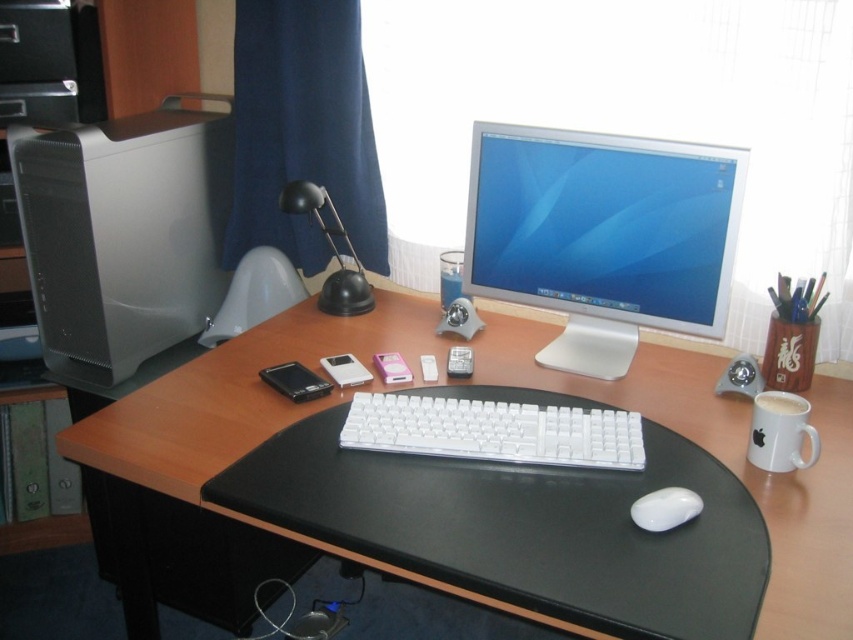
Question: Which of the following is the farthest from the observer?

Choices:
 (A) (421, 403)
 (B) (120, 330)
 (C) (285, 250)

Answer: (C)

Question: Can you confirm if satin white monitor at center is bigger than white ceramic mug at right?

Choices:
 (A) yes
 (B) no

Answer: (A)

Question: Which of the following is the closest to the observer?

Choices:
 (A) satin silver desktop computer at left
 (B) black plastic lamp at center
 (C) satin white monitor at center

Answer: (C)

Question: Considering the real-world distances, which object is closest to the satin white monitor at center?

Choices:
 (A) satin silver desktop computer at left
 (B) black plastic lamp at center

Answer: (B)

Question: Does white ceramic mug at right come in front of black plastic lamp at center?

Choices:
 (A) yes
 (B) no

Answer: (A)

Question: Where is satin white monitor at center located in relation to white ceramic mug at right in the image?

Choices:
 (A) below
 (B) above

Answer: (B)